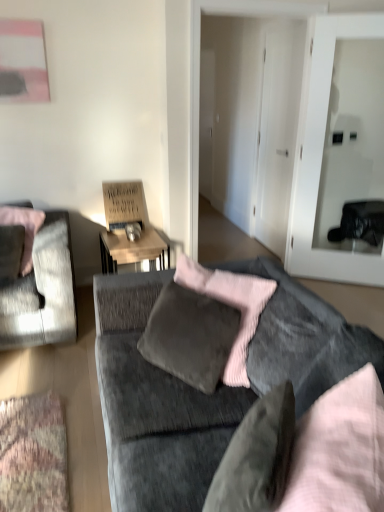
Question: Should I look upward or downward to see transparent glass door at center right?

Choices:
 (A) down
 (B) up

Answer: (B)

Question: Is velvet gray pillow at center, acting as the first pillow starting from the right, to the right of wooden desk at center from the viewer's perspective?

Choices:
 (A) no
 (B) yes

Answer: (B)

Question: Is velvet gray pillow at center, which appears as the second pillow when viewed from the back, positioned far away from wooden desk at center?

Choices:
 (A) yes
 (B) no

Answer: (A)

Question: From a real-world perspective, is velvet gray pillow at center, which is the 2th pillow in top-to-bottom order, physically above wooden desk at center?

Choices:
 (A) no
 (B) yes

Answer: (B)

Question: Does velvet gray pillow at center, which is counted as the second pillow, starting from the left, lie behind wooden desk at center?

Choices:
 (A) yes
 (B) no

Answer: (B)

Question: Considering the relative sizes of velvet gray pillow at center, which is the 2th pillow in top-to-bottom order, and wooden desk at center in the image provided, is velvet gray pillow at center, which is the 2th pillow in top-to-bottom order, bigger than wooden desk at center?

Choices:
 (A) yes
 (B) no

Answer: (B)

Question: Is velvet gray pillow at center, which appears as the second pillow when viewed from the back, thinner than wooden desk at center?

Choices:
 (A) yes
 (B) no

Answer: (A)

Question: Is the position of wooden desk at center less distant than that of velvet gray couch at center?

Choices:
 (A) yes
 (B) no

Answer: (B)

Question: Is wooden desk at center facing towards velvet gray couch at center?

Choices:
 (A) yes
 (B) no

Answer: (A)

Question: Is wooden desk at center positioned far away from velvet gray couch at center?

Choices:
 (A) yes
 (B) no

Answer: (A)

Question: Is wooden desk at center next to velvet gray couch at center and touching it?

Choices:
 (A) yes
 (B) no

Answer: (B)

Question: Can you confirm if wooden desk at center is taller than velvet gray couch at center?

Choices:
 (A) no
 (B) yes

Answer: (A)

Question: Is wooden desk at center to the right of velvet gray couch at center from the viewer's perspective?

Choices:
 (A) no
 (B) yes

Answer: (A)

Question: Could you tell me if velvet gray pillow at center, which ranks as the 1th pillow in front-to-back order, is facing velvet grey chair at left?

Choices:
 (A) yes
 (B) no

Answer: (B)